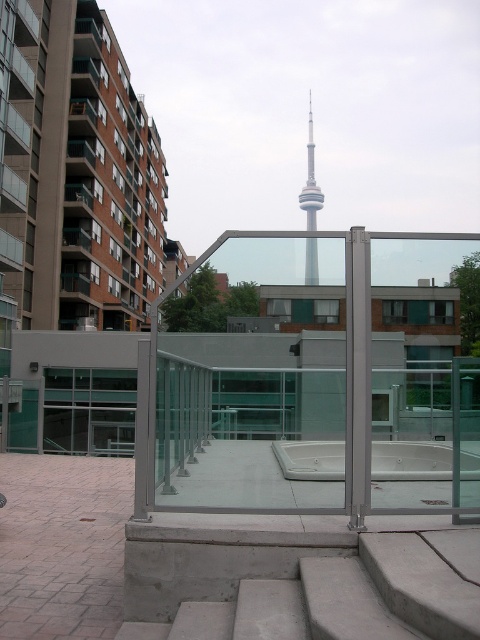
You are standing on the rooftop terrace and want to take a photo of both the white glossy pool at center and the silver metallic tower at center. Which object should you focus on first to ensure both are in the frame?

You should focus on the white glossy pool at center first because it is closer to you than the silver metallic tower at center, ensuring both are in the frame.

You are standing on the rooftop terrace and want to take a photo of both the point at coordinates point (x=414, y=445) and the point at coordinates point (x=311, y=260). Which point should you focus on first to ensure both are in the frame?

You should focus on point (x=311, y=260) first because it is closer to the camera than point (x=414, y=445). This way, both points will be in the frame as the camera adjusts the focus.

In the scene shown: You are standing on the rooftop terrace and want to enter the building through the transparent glass door at center. There is a silver metallic tower at center blocking your path. Can you walk around the tower to reach the door without going through the hot tub?

The transparent glass door at center is shorter than the silver metallic tower at center, so you can walk around the tower to reach the door without going through the hot tub.